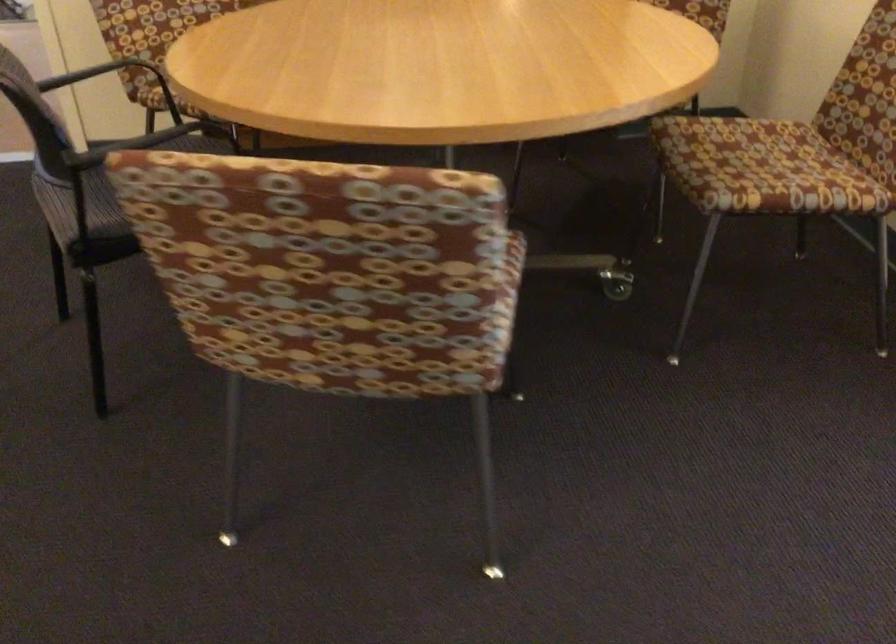
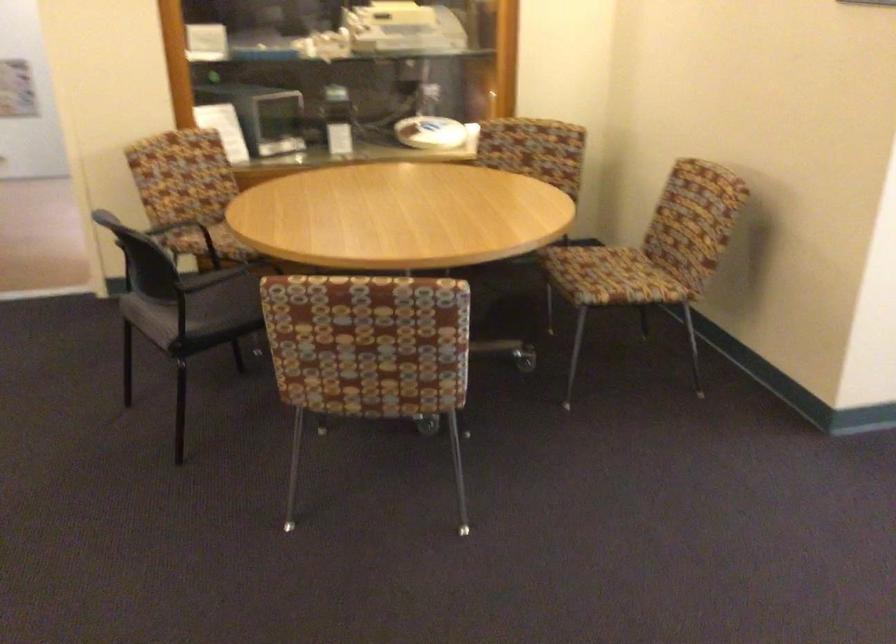
Find the pixel in the second image that matches (165,71) in the first image.

(228, 229)